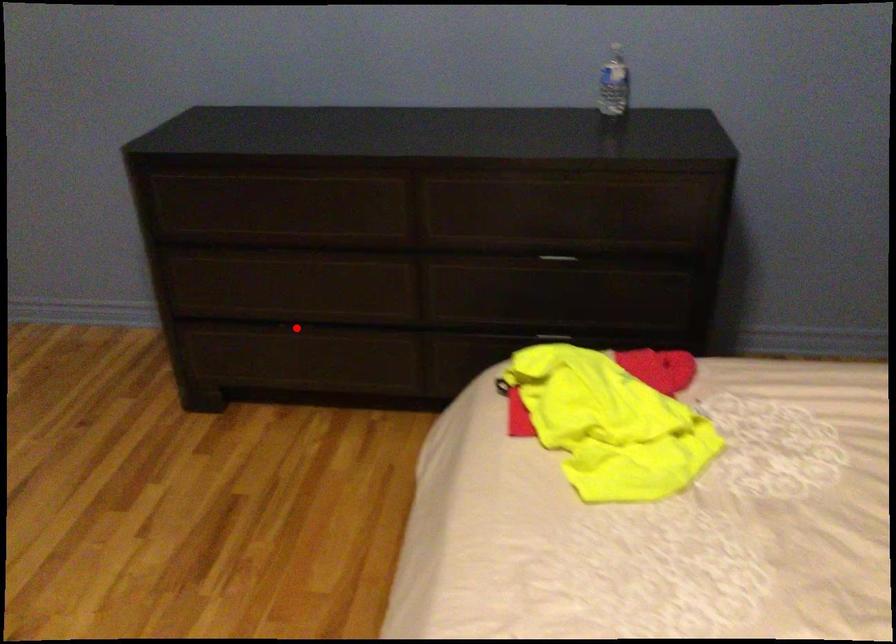
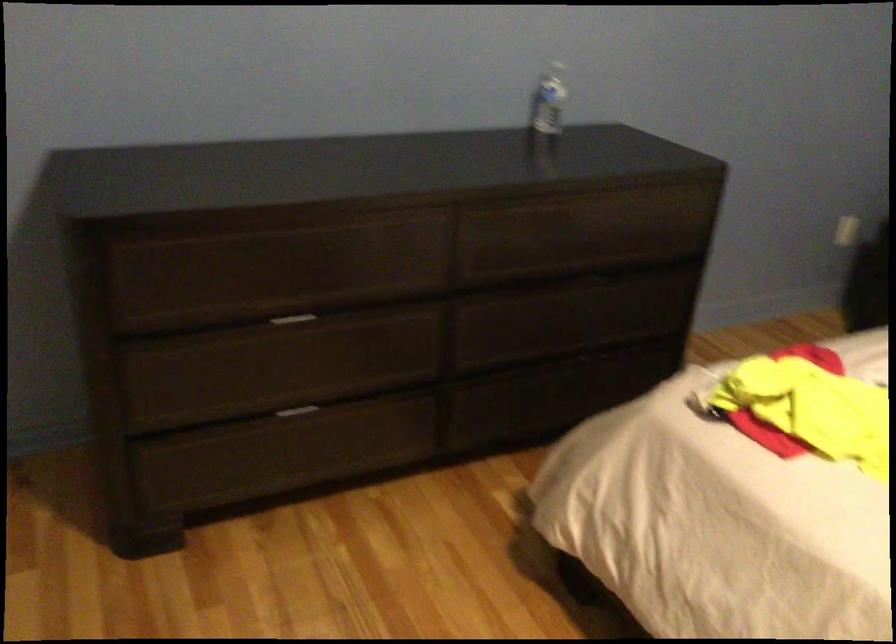
Locate, in the second image, the point that corresponds to the highlighted location in the first image.

(297, 411)